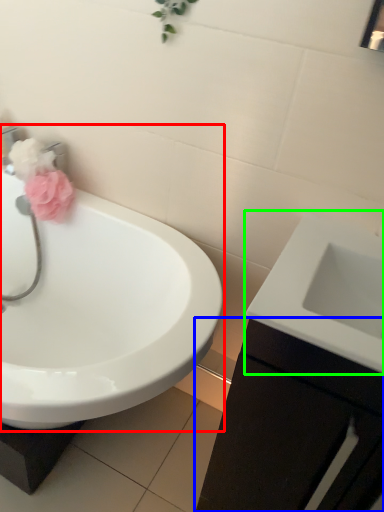
Question: Estimate the real-world distances between objects in this image. Which object is farther from sink (highlighted by a red box), bathroom cabinet (highlighted by a blue box) or sink (highlighted by a green box)?

Choices:
 (A) bathroom cabinet
 (B) sink

Answer: (B)